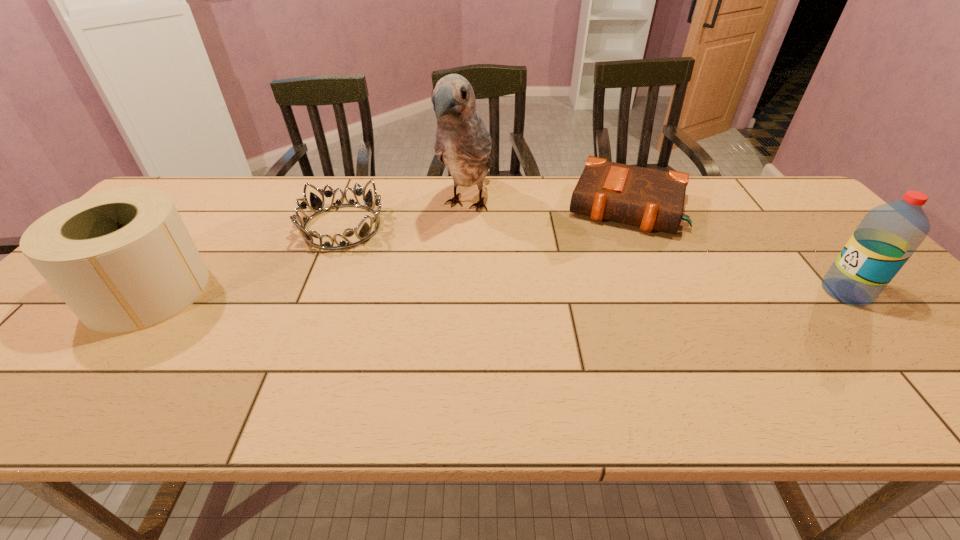
Where is `free space on the desktop that is between the third tallest object and the water bottle and is positioned on the front-facing side of the tallest object`? Image resolution: width=960 pixels, height=540 pixels. free space on the desktop that is between the third tallest object and the water bottle and is positioned on the front-facing side of the tallest object is located at coordinates (416, 292).

The height and width of the screenshot is (540, 960). Identify the location of vacant space on the desktop that is between the third shortest object and the second tallest object and is positioned on the front-facing side of the tiara. (452, 292).

Image resolution: width=960 pixels, height=540 pixels. Find the location of `vacant space on the desktop that is between the third tallest object and the fourth shortest object and is positioned on the spine side of the Bible`. vacant space on the desktop that is between the third tallest object and the fourth shortest object and is positioned on the spine side of the Bible is located at coordinates (601, 292).